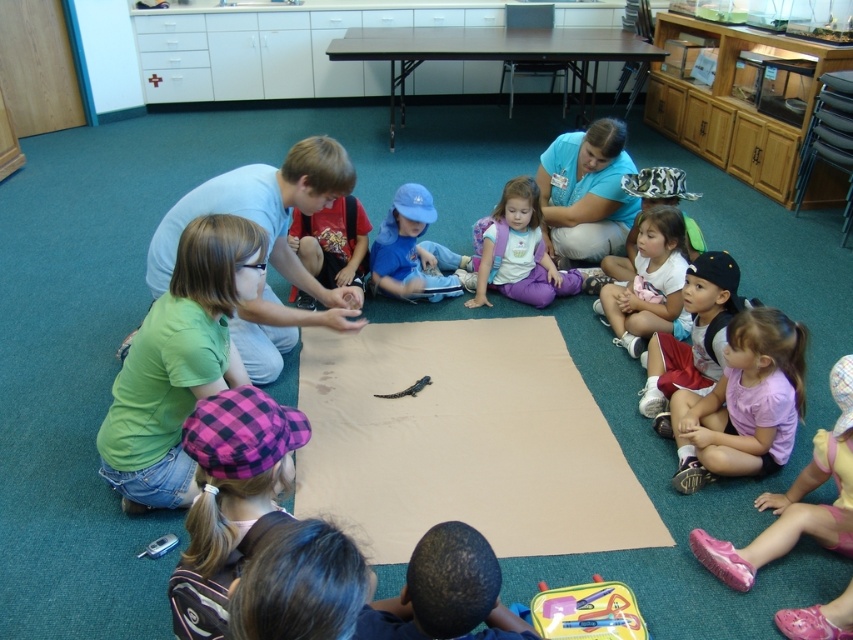
Can you confirm if pink cotton shirt at lower right is wider than white cotton shirt at lower right?

Yes, pink cotton shirt at lower right is wider than white cotton shirt at lower right.

I want to click on pink cotton shirt at lower right, so click(x=744, y=403).

Identify the location of pink cotton shirt at lower right. [x=744, y=403].

Measure the distance from green matte shirt at lower left to dark brown hair at lower center.

green matte shirt at lower left is 38.62 inches from dark brown hair at lower center.

At what (x,y) coordinates should I click in order to perform the action: click on green matte shirt at lower left. Please return your answer as a coordinate pair (x, y). Image resolution: width=853 pixels, height=640 pixels. Looking at the image, I should click on (177, 362).

This screenshot has height=640, width=853. Identify the location of green matte shirt at lower left. (177, 362).

Which is below, green matte shirt at lower left or blue smooth shirt at upper center?

green matte shirt at lower left is lower down.

Which is more to the right, green matte shirt at lower left or blue smooth shirt at upper center?

blue smooth shirt at upper center

Is point (134, 365) closer to viewer compared to point (569, 188)?

Yes, point (134, 365) is closer to viewer.

Locate an element on the screen. green matte shirt at lower left is located at coordinates (177, 362).